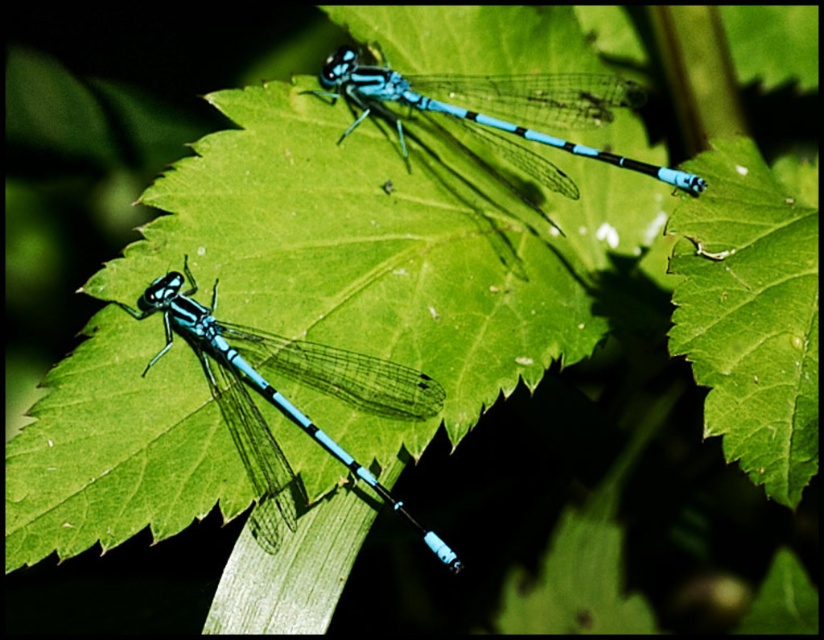
You are a photographer aiming to capture the dragonflies in the scene. You notice a point at coordinates point (x=748, y=314). What object is located at this point?

The green matte leaf at upper right is located at point (x=748, y=314).

From the picture: You are an entomologist observing dragonflies in a garden. You notice the green matte leaf at upper right and the blue glossy dragonfly at upper center. Which object is positioned higher in the image?

The blue glossy dragonfly at upper center is positioned higher than the green matte leaf at upper right, as the leaf is located below the dragonfly.

You are an entomologist observing dragonflies in a wetland. You notice the translucent blue dragonfly at lower left and the blue glossy dragonfly at upper center. Which dragonfly is located to the left of the other?

The translucent blue dragonfly at lower left is positioned on the left side of blue glossy dragonfly at upper center.